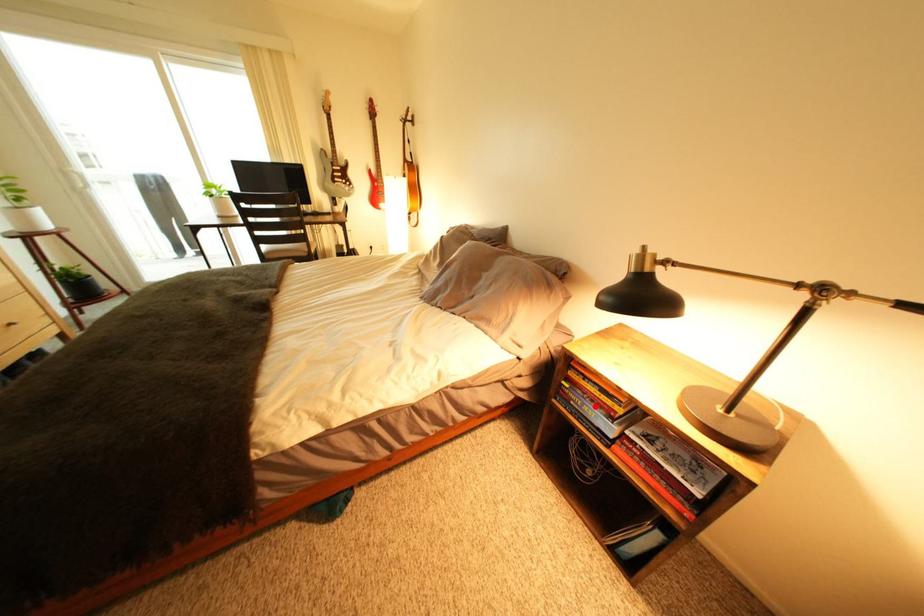
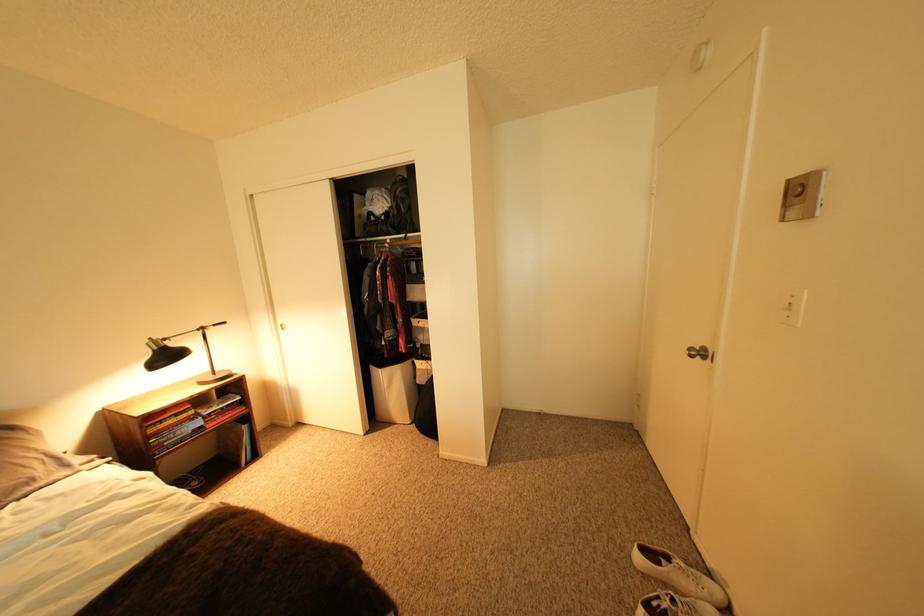
In the second image, find the point that corresponds to the highlighted location in the first image.

(188, 435)